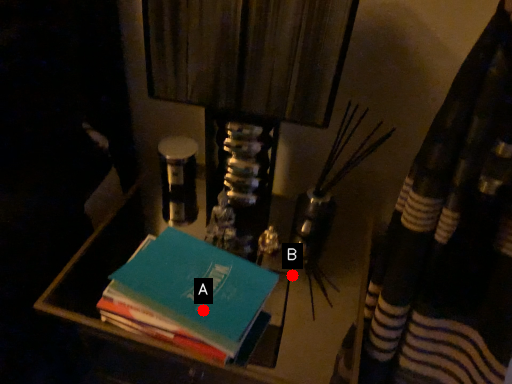
Question: Two points are circled on the image, labeled by A and B beside each circle. Which point is closer to the camera taking this photo?

Choices:
 (A) A is closer
 (B) B is closer

Answer: (A)